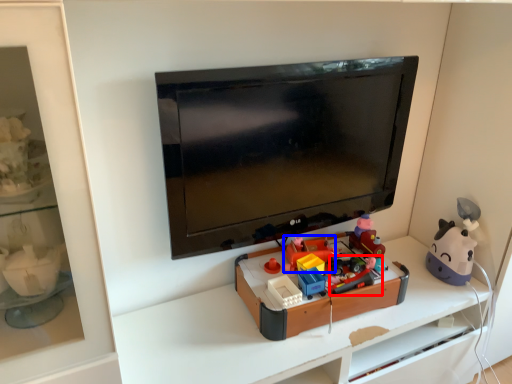
Question: Among these objects, which one is nearest to the camera, toy (highlighted by a red box) or toy (highlighted by a blue box)?

Choices:
 (A) toy
 (B) toy

Answer: (A)